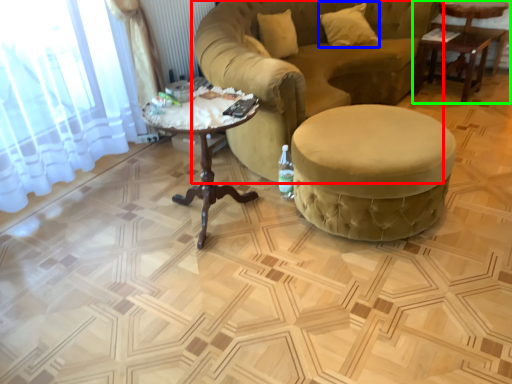
Question: Which object is the farthest from studio couch (highlighted by a red box)? Choose among these: pillow (highlighted by a blue box) or table (highlighted by a green box).

Choices:
 (A) pillow
 (B) table

Answer: (B)